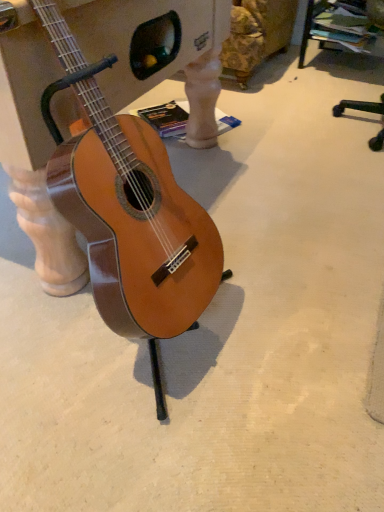
You are a GUI agent. You are given a task and a screenshot of the screen. Output one action in this format:
    pyautogui.click(x=<x>, y=<y>)
    Task: Click on the vacant space in natural wood guitar at center (from a real-world perspective)
    The image size is (384, 512).
    Given the screenshot: What is the action you would take?
    pyautogui.click(x=142, y=347)